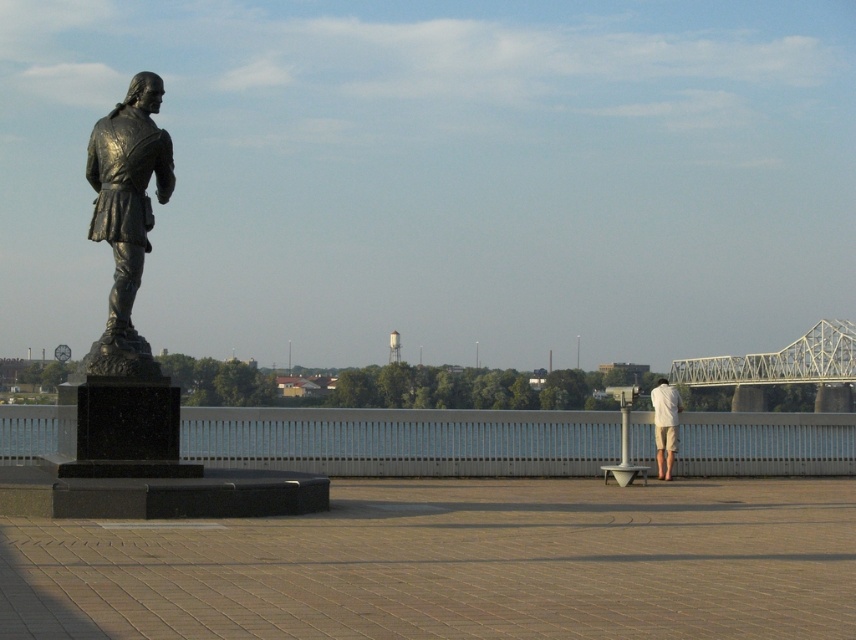
Question: Considering the relative positions of white metallic bridge at right and white cotton shorts at right in the image provided, where is white metallic bridge at right located with respect to white cotton shorts at right?

Choices:
 (A) left
 (B) right

Answer: (B)

Question: Is white metallic bridge at right to the left of white cotton shorts at right from the viewer's perspective?

Choices:
 (A) no
 (B) yes

Answer: (A)

Question: Is bronze statue at left smaller than white metallic bridge at right?

Choices:
 (A) no
 (B) yes

Answer: (B)

Question: Which point is farther to the camera?

Choices:
 (A) (x=807, y=356)
 (B) (x=98, y=124)
 (C) (x=664, y=388)

Answer: (A)

Question: Considering the real-world distances, which object is farthest from the white metallic bridge at right?

Choices:
 (A) white cotton shorts at right
 (B) bronze statue at left

Answer: (B)

Question: Estimate the real-world distances between objects in this image. Which object is closer to the bronze statue at left?

Choices:
 (A) white cotton shorts at right
 (B) white metallic bridge at right

Answer: (A)